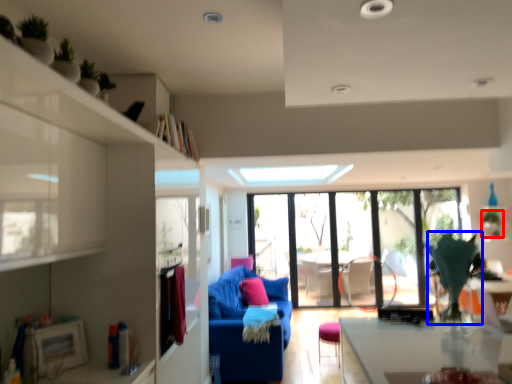
Question: Which object is closer to the camera taking this photo, plant (highlighted by a red box) or plant (highlighted by a blue box)?

Choices:
 (A) plant
 (B) plant

Answer: (B)